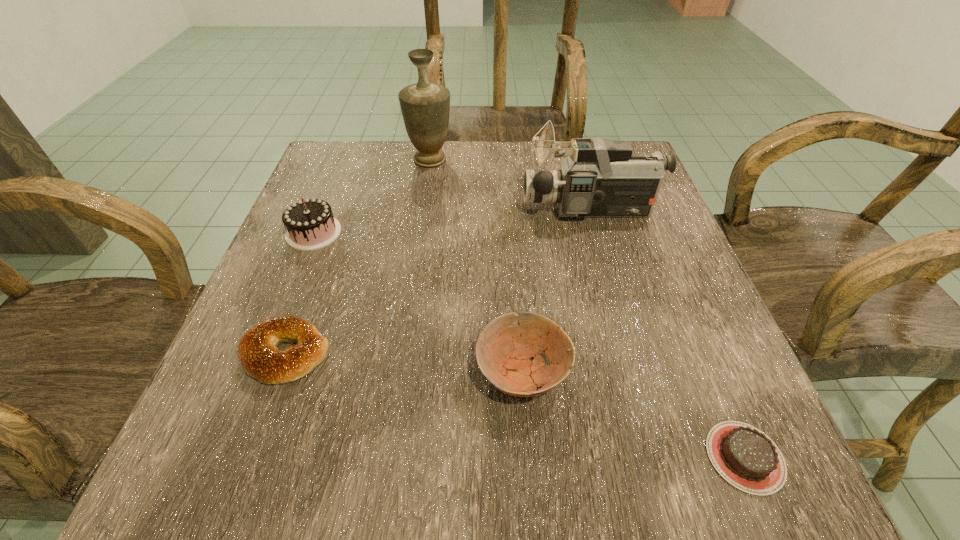
The width and height of the screenshot is (960, 540). What are the coordinates of `the tallest object` in the screenshot? It's located at (425, 107).

Find the location of a particular element. This screenshot has height=540, width=960. urn is located at coordinates (425, 107).

Find the location of a particular element. This screenshot has height=540, width=960. camcorder is located at coordinates (601, 178).

Where is `the taller chocolate cake`? This screenshot has height=540, width=960. the taller chocolate cake is located at coordinates click(x=310, y=223).

Locate an element on the screen. The image size is (960, 540). the fourth shortest object is located at coordinates (310, 223).

Locate an element on the screen. This screenshot has height=540, width=960. the fourth tallest object is located at coordinates (503, 353).

Find the location of a particular element. the second shortest object is located at coordinates (257, 352).

Image resolution: width=960 pixels, height=540 pixels. I want to click on the right chocolate cake, so click(x=744, y=456).

Image resolution: width=960 pixels, height=540 pixels. I want to click on the nearer chocolate cake, so click(x=744, y=456).

Where is `vacant region located 0.380m on the right of the urn`? The height and width of the screenshot is (540, 960). vacant region located 0.380m on the right of the urn is located at coordinates (613, 160).